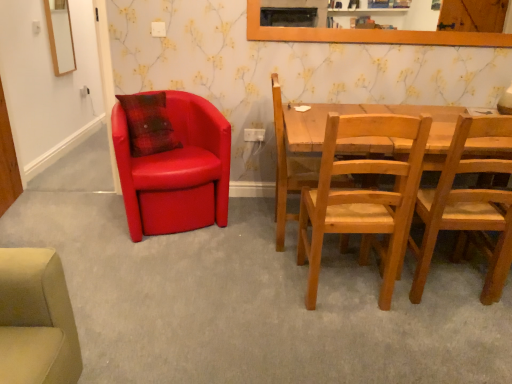
This screenshot has height=384, width=512. In order to click on free space to the left of matte leather chair at left, which appears as the 1th chair when viewed from the left in this screenshot , I will do `click(81, 215)`.